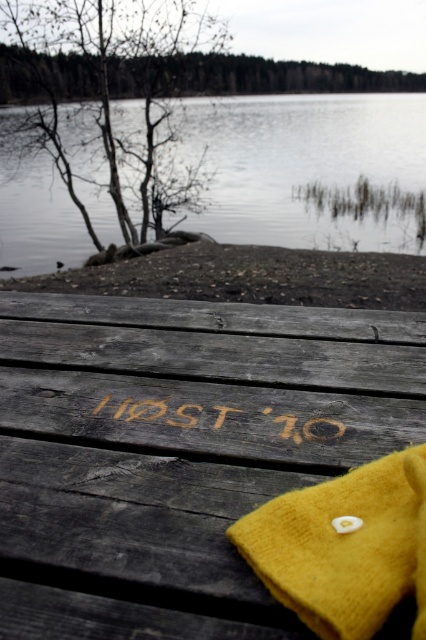
You are standing on the wooden dock and see the mustard felt hat at center and the gray weathered wood plank at center. Which object is positioned to the right side?

The mustard felt hat at center is positioned to the right of the gray weathered wood plank at center, so the mustard felt hat at center is on the right side.